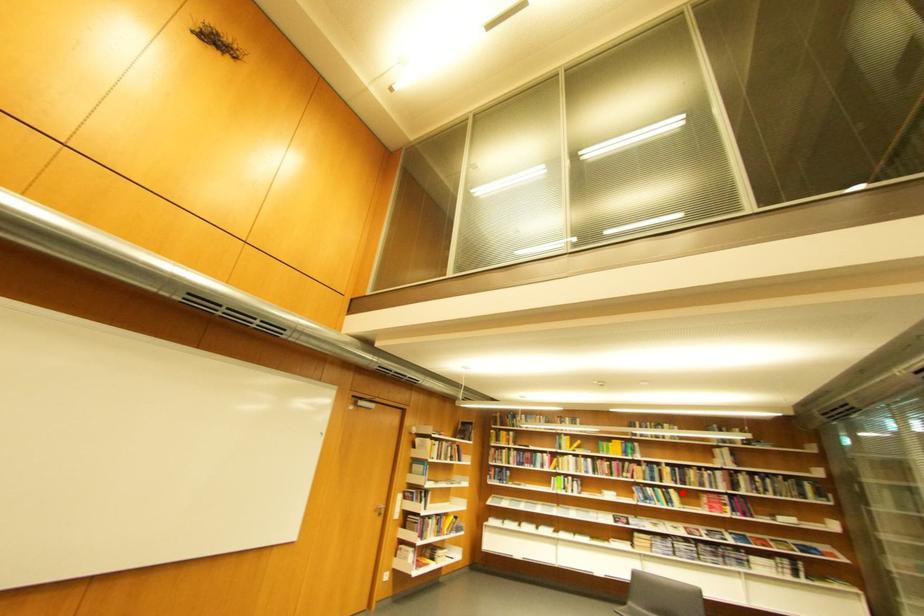
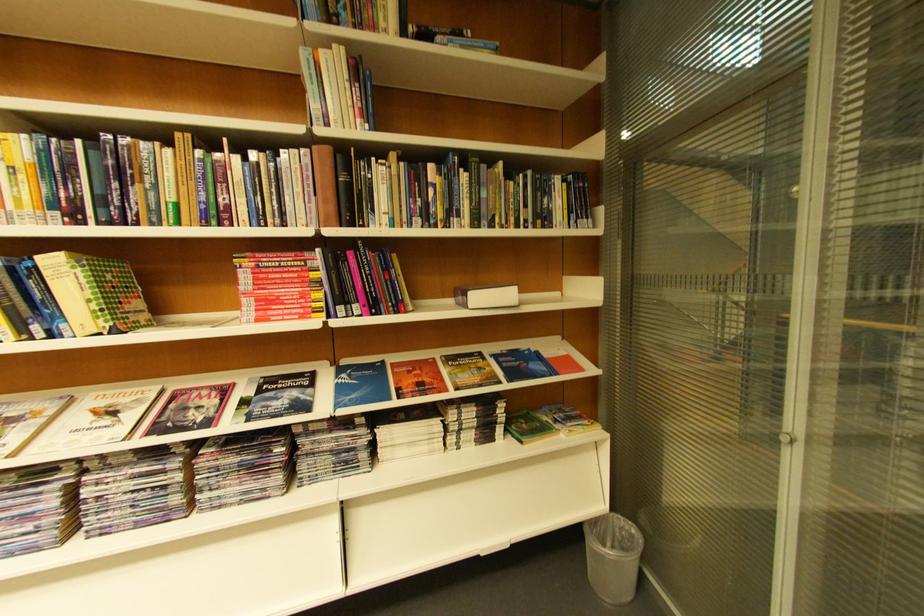
The point at the highlighted location is marked in the first image. Where is the corresponding point in the second image?

(63, 264)